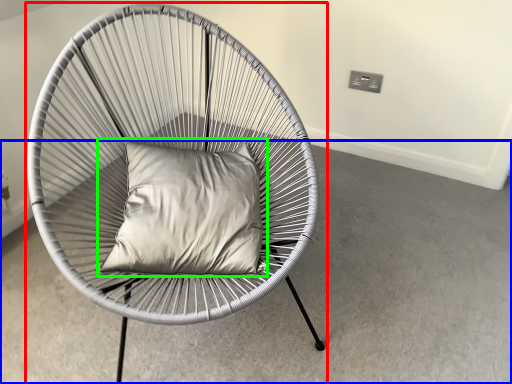
Question: Which object is positioned farthest from chair (highlighted by a red box)? Select from concrete (highlighted by a blue box) and pillow (highlighted by a green box).

Choices:
 (A) concrete
 (B) pillow

Answer: (A)